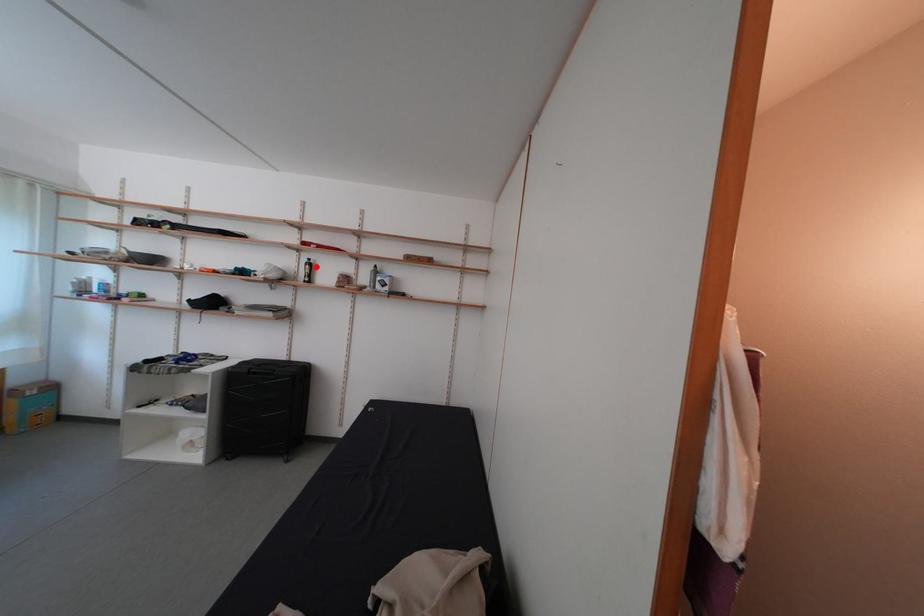
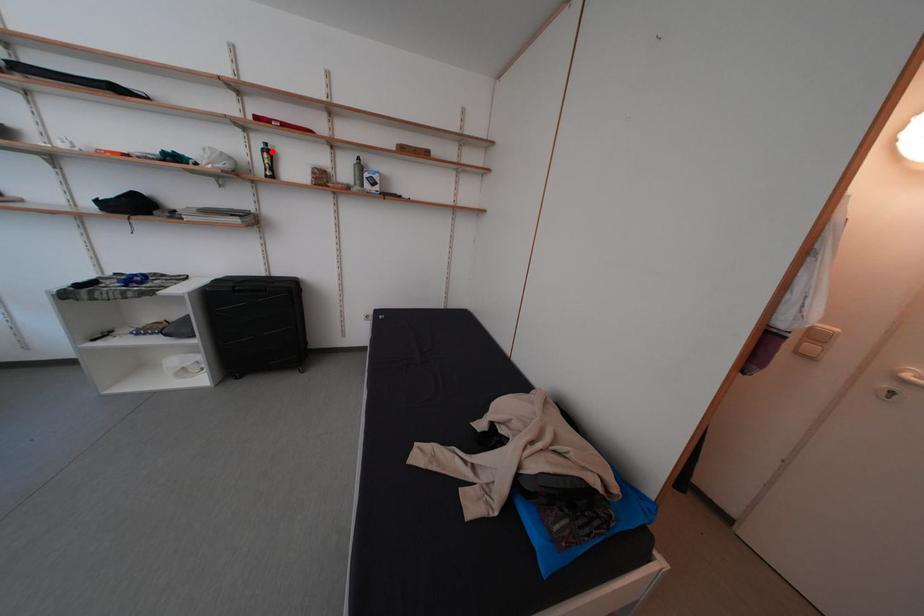
I am providing you with two images of the same scene from different viewpoints. A red point is marked on the first image and another point is marked on the second image. Is the marked point in image1 the same physical position as the marked point in image2?

Yes